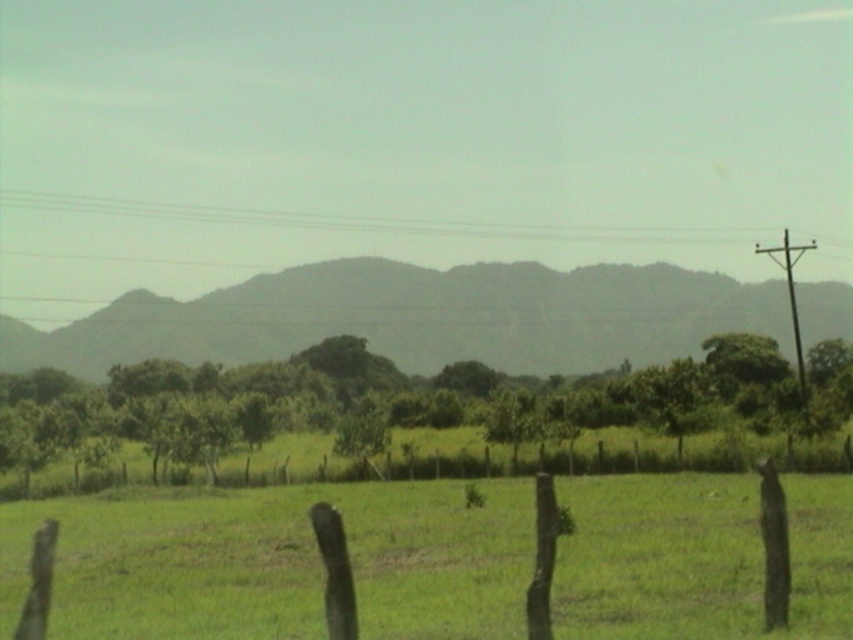
You are standing at the edge of the green wooden fence at lower center. Looking towards the gray textured mountain at center, in which direction should you walk to get closer to the mountain?

You should walk forward towards the gray textured mountain at center because it is located above the green wooden fence at lower center, indicating it is in the distance ahead of you.

You are standing at the edge of the green grassy field at center and want to walk to the green wooden fence at lower center. Which direction should you go to reach it?

The green wooden fence at lower center is positioned below the green grassy field at center, so you should walk downward to reach it.

You are a hiker trying to find the best path to reach the hills in the background. You see the green grassy field at center and the metallic pole at right. Which direction should you head towards to get closer to the hills?

The green grassy field at center is positioned on the left side of metallic pole at right, so heading towards the metallic pole at right would lead you closer to the hills in the background.